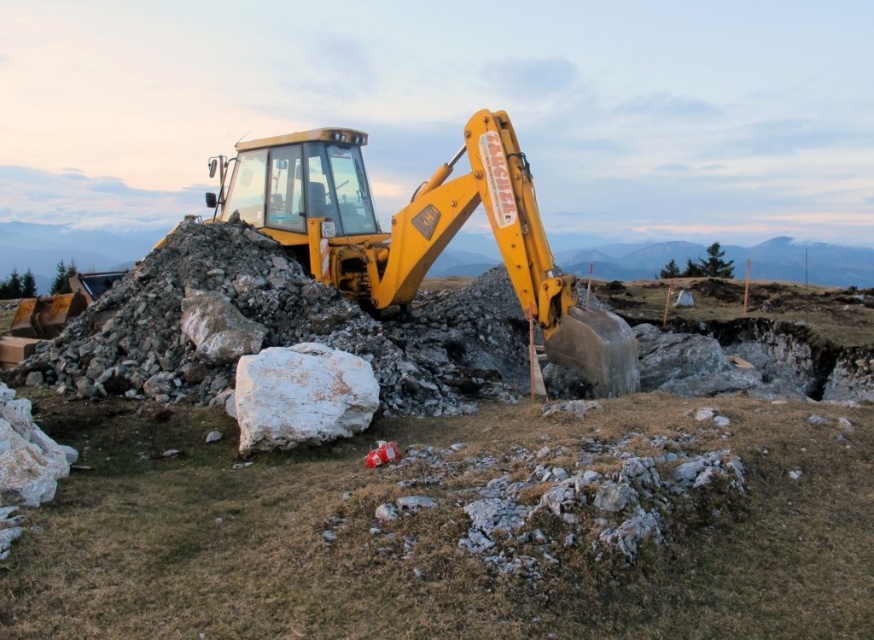
Does yellow metallic excavator at upper center have a lesser width compared to yellow metallic tractor at center?

In fact, yellow metallic excavator at upper center might be wider than yellow metallic tractor at center.

Image resolution: width=874 pixels, height=640 pixels. What do you see at coordinates (446, 529) in the screenshot? I see `yellow metallic excavator at upper center` at bounding box center [446, 529].

Identify the location of yellow metallic excavator at upper center. The height and width of the screenshot is (640, 874). (446, 529).